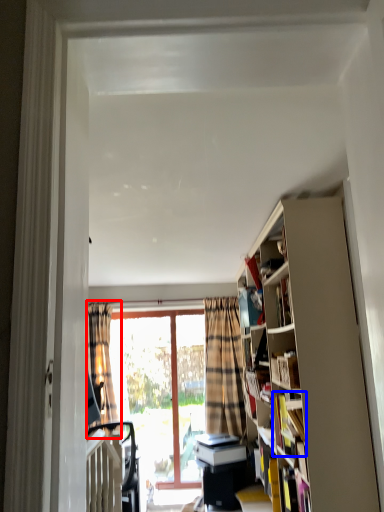
Question: Among these objects, which one is farthest to the camera, curtain (highlighted by a red box) or book (highlighted by a blue box)?

Choices:
 (A) curtain
 (B) book

Answer: (A)